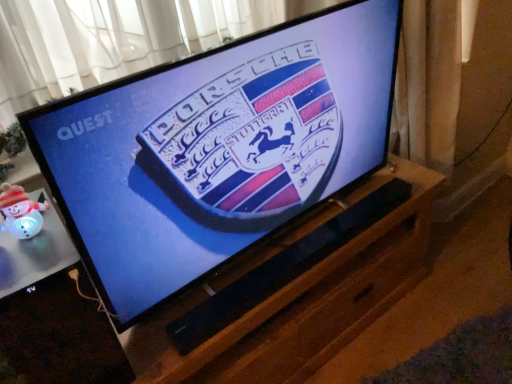
This screenshot has height=384, width=512. What are the coordinates of `empty space that is ontop of white glossy snowman at lower left (from a real-world perspective)` in the screenshot? It's located at (34, 248).